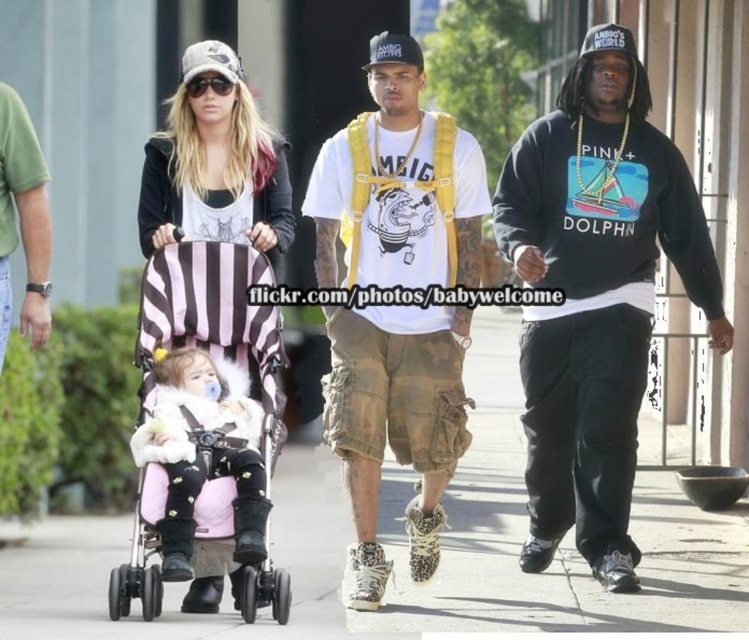
From the picture: You are standing at the point marked at coordinates (x=595, y=294) in the image. What object is located at this point?

The point at coordinates (x=595, y=294) corresponds to the black cotton sweatshirt at right.

You are a fashion designer observing the group. Which clothing item, the black cotton sweatshirt at right or the matte black jacket at center, has a greater height when comparing their sizes?

The black cotton sweatshirt at right is taller than the matte black jacket at center, so it has a greater height.

Consider the image. You are a photographer trying to capture the matte black jacket at center and the fuzzy white coat at center in a single shot. Which jacket is closer to the camera?

The matte black jacket at center is closer to the camera because it is positioned over the fuzzy white coat at center.